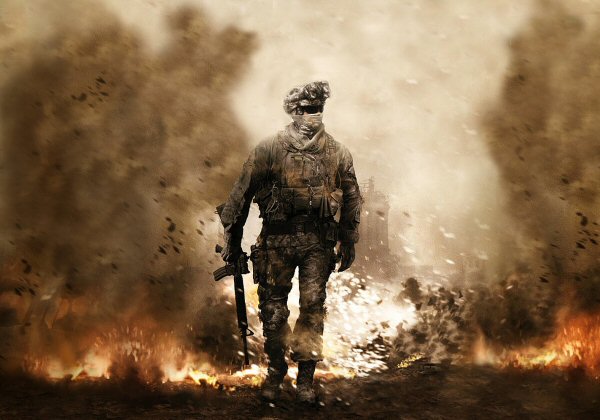
Locate an element on the screen. This screenshot has width=600, height=420. chest is located at coordinates (300, 163).